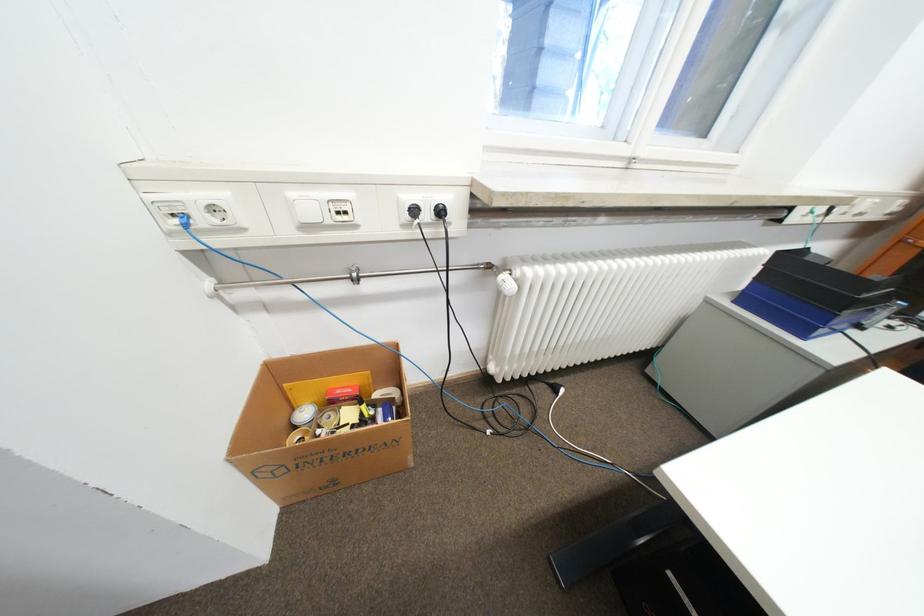
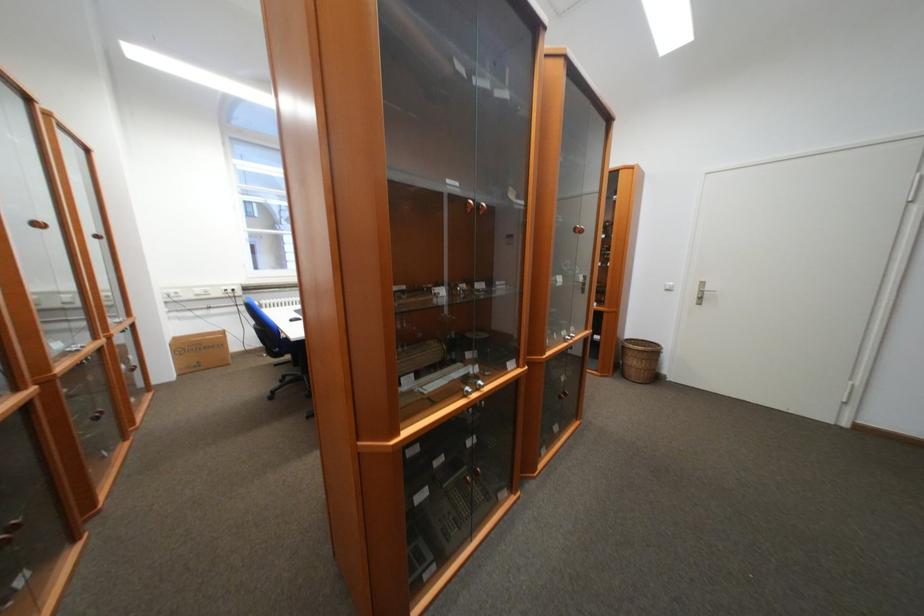
In the second image, find the point that corresponds to point (213, 221) in the first image.

(181, 296)